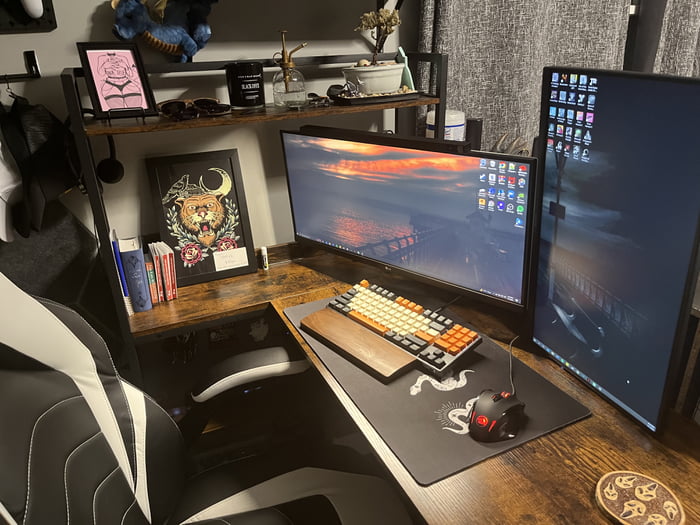
Where is `computer desk chair`? computer desk chair is located at coordinates (218, 506).